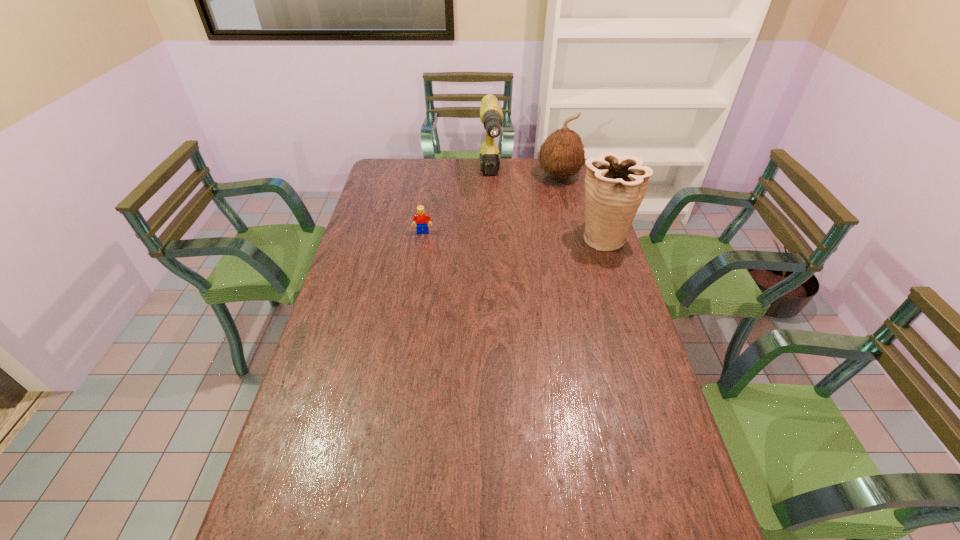
Find the location of a particular element. Image resolution: width=960 pixels, height=540 pixels. vacant space located 0.270m on the surface of the coconut is located at coordinates (541, 223).

The height and width of the screenshot is (540, 960). I want to click on free region located on the surface of the coconut, so click(537, 237).

Find the location of a particular element. The image size is (960, 540). free spot located on the surface of the coconut is located at coordinates (543, 217).

The image size is (960, 540). Find the location of `drill at the far edge`. drill at the far edge is located at coordinates (491, 116).

Locate an element on the screen. This screenshot has width=960, height=540. coconut located in the far edge section of the desktop is located at coordinates (562, 154).

Find the location of a particular element. Image resolution: width=960 pixels, height=540 pixels. urn situated at the right edge is located at coordinates (615, 185).

Find the location of `coconut positioned at the right edge`. coconut positioned at the right edge is located at coordinates (562, 154).

Locate an element on the screen. This screenshot has height=540, width=960. object at the far right corner is located at coordinates (562, 154).

In the image, there is a desktop. Where is `free region at the far edge`? Image resolution: width=960 pixels, height=540 pixels. free region at the far edge is located at coordinates (509, 170).

The height and width of the screenshot is (540, 960). What are the coordinates of `vacant area at the near edge of the desktop` in the screenshot? It's located at (376, 534).